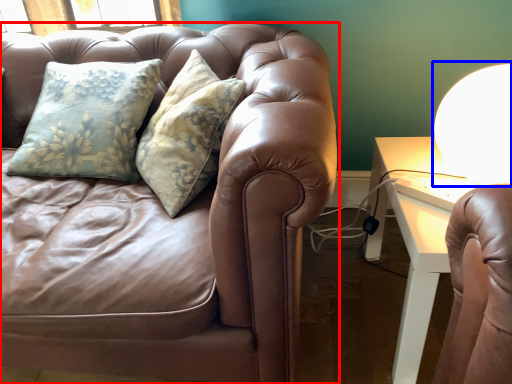
Question: Which of the following is the farthest to the observer, studio couch (highlighted by a red box) or table lamp (highlighted by a blue box)?

Choices:
 (A) studio couch
 (B) table lamp

Answer: (B)